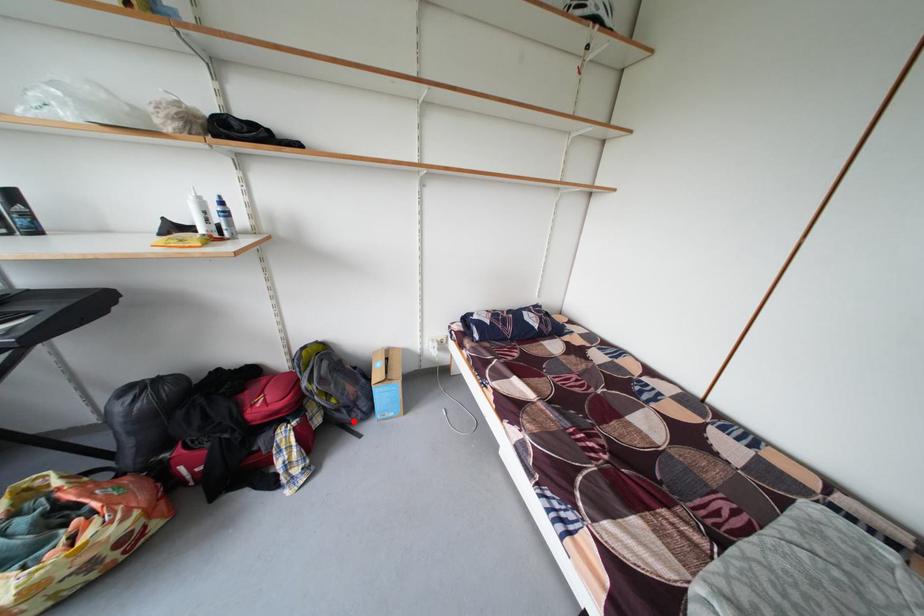
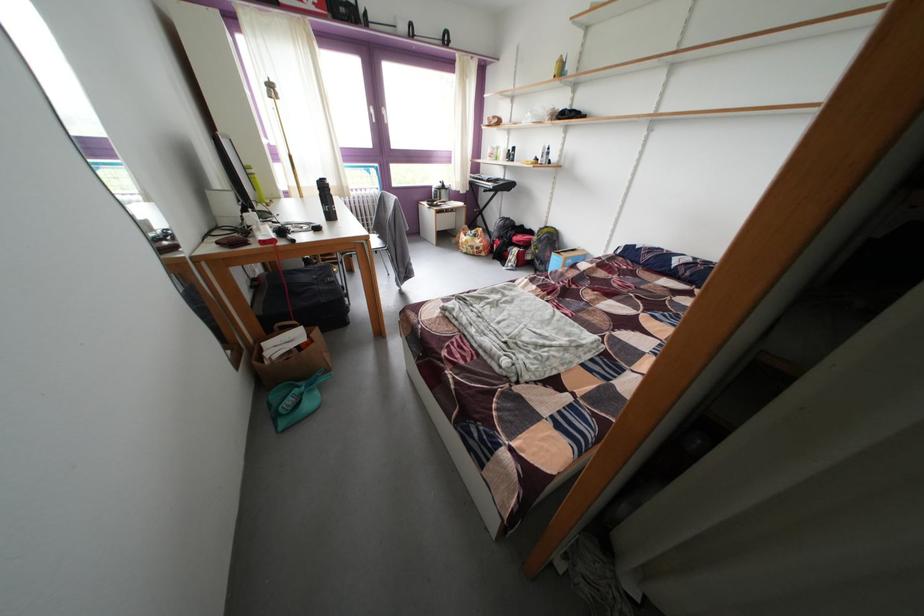
Question: I am providing you with two images of the same scene from different viewpoints. A red point is shown in image1. For the corresponding object point in image2, is it positioned nearer or farther from the camera?

Choices:
 (A) Nearer
 (B) Farther

Answer: (B)